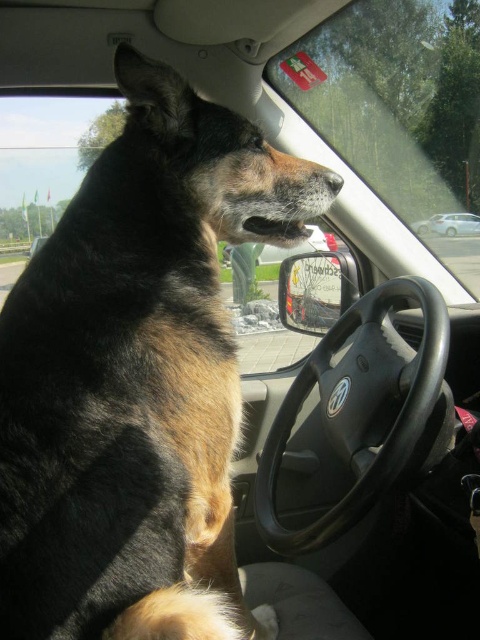
Question: Which object is positioned closest to the black leather steering wheel at center?

Choices:
 (A) metallic silver car at center
 (B) black smooth nose at center
 (C) black fur dog at left
 (D) transparent glass window at upper center

Answer: (D)

Question: Is black leather steering wheel at center wider than metallic silver car at center?

Choices:
 (A) yes
 (B) no

Answer: (A)

Question: Where is black fur dog at left located in relation to metallic silver car at center in the image?

Choices:
 (A) left
 (B) right

Answer: (A)

Question: Considering the relative positions of black fur dog at left and transparent glass window at upper center in the image provided, where is black fur dog at left located with respect to transparent glass window at upper center?

Choices:
 (A) below
 (B) above

Answer: (A)

Question: Which of the following is the closest to the observer?

Choices:
 (A) black fur dog at left
 (B) transparent glass window at upper center
 (C) black leather steering wheel at center
 (D) black smooth nose at center

Answer: (A)

Question: Which point appears farthest from the camera in this image?

Choices:
 (A) (338, 177)
 (B) (141, 100)
 (C) (340, 81)

Answer: (C)